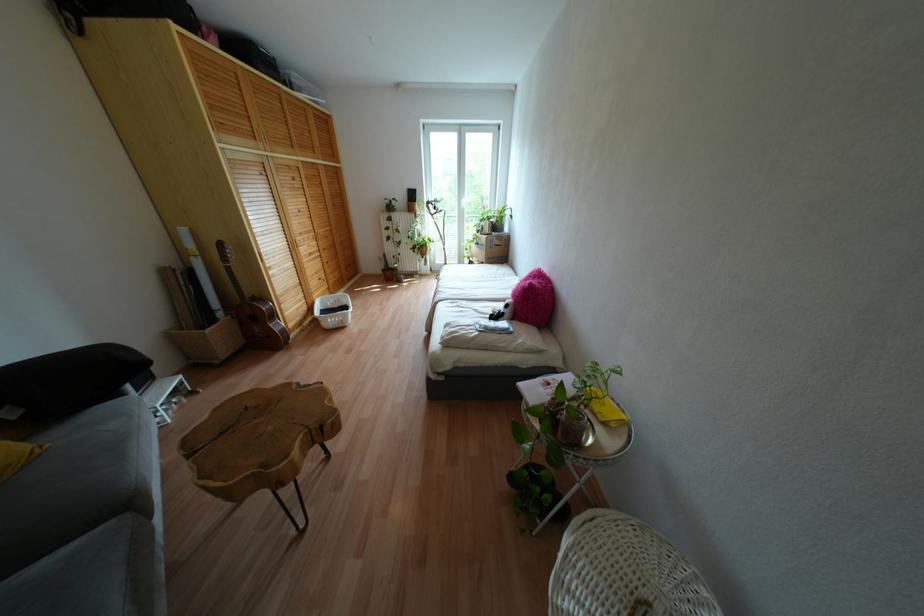
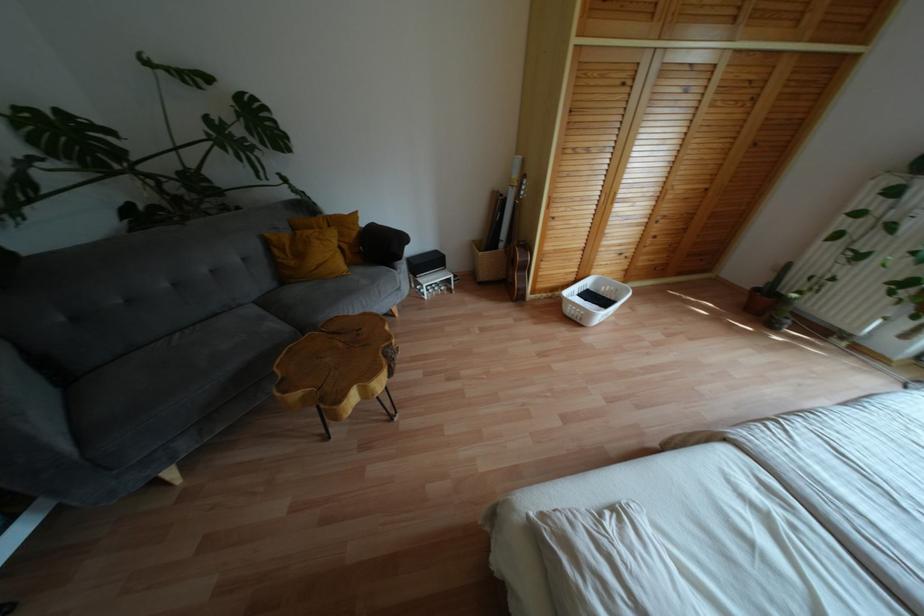
In the second image, find the point that corresponds to [335,325] in the first image.

(573, 318)